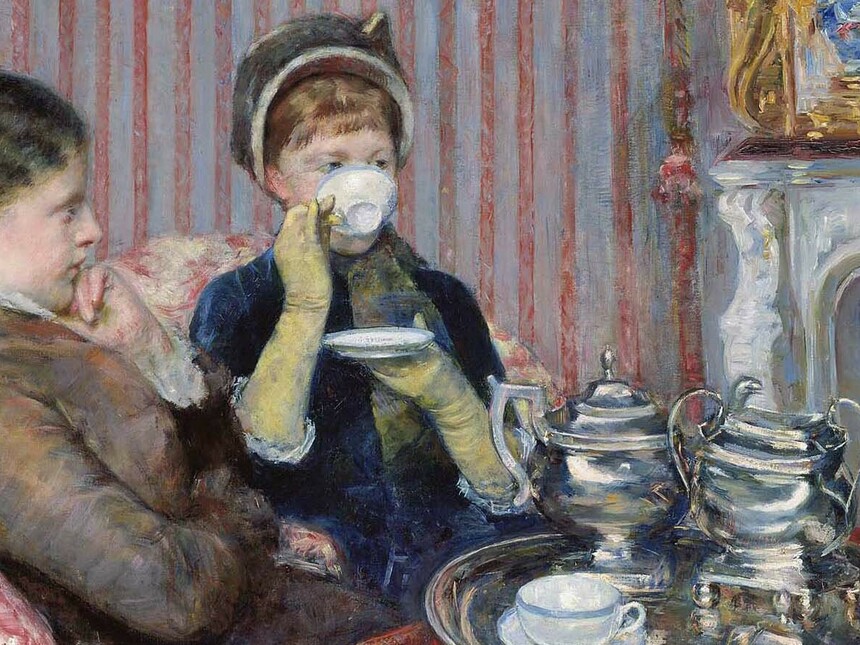
Locate an element on the screen. The height and width of the screenshot is (645, 860). handle is located at coordinates (511, 392), (508, 467), (631, 626), (332, 217).